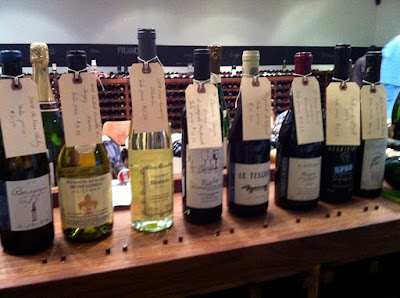
Locate an element on the screen. The image size is (400, 298). top of wooden bar is located at coordinates (24, 270), (107, 266), (161, 239), (210, 239), (278, 225), (350, 212), (383, 211).